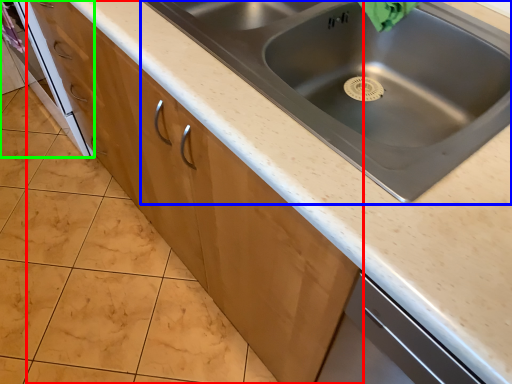
Question: Which is nearer to the cabinetry (highlighted by a red box)? sink (highlighted by a blue box) or oven (highlighted by a green box).

Choices:
 (A) sink
 (B) oven

Answer: (A)